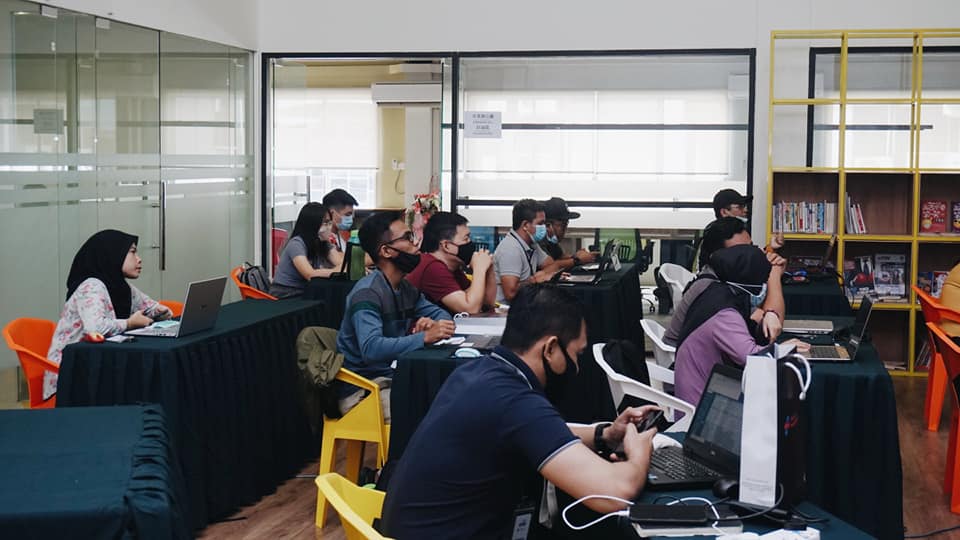
Identify the location of glass partition. The height and width of the screenshot is (540, 960). pos(112,108).